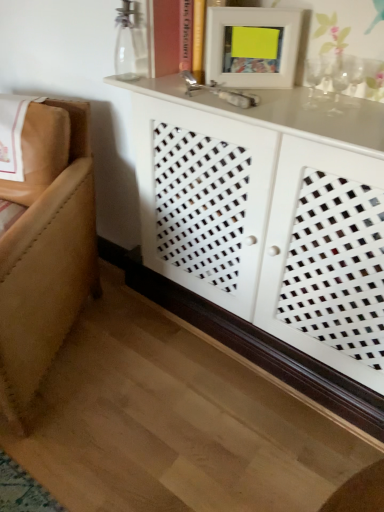
Question: Is white lattice cabinet at center smaller than clear glass vase at upper center?

Choices:
 (A) yes
 (B) no

Answer: (B)

Question: Is white lattice cabinet at center not inside clear glass vase at upper center?

Choices:
 (A) no
 (B) yes

Answer: (B)

Question: Is white lattice cabinet at center at the left side of clear glass vase at upper center?

Choices:
 (A) yes
 (B) no

Answer: (B)

Question: Does white lattice cabinet at center lie in front of clear glass vase at upper center?

Choices:
 (A) no
 (B) yes

Answer: (B)

Question: Is white lattice cabinet at center further to camera compared to clear glass vase at upper center?

Choices:
 (A) no
 (B) yes

Answer: (A)

Question: Visually, is tan leather couch at left positioned to the left or to the right of white lattice cabinet at center?

Choices:
 (A) right
 (B) left

Answer: (B)

Question: Relative to white lattice cabinet at center, is tan leather couch at left in front or behind?

Choices:
 (A) behind
 (B) front

Answer: (A)

Question: In terms of size, does tan leather couch at left appear bigger or smaller than white lattice cabinet at center?

Choices:
 (A) big
 (B) small

Answer: (B)

Question: From a real-world perspective, is tan leather couch at left positioned above or below white lattice cabinet at center?

Choices:
 (A) above
 (B) below

Answer: (B)

Question: Considering the positions of white matte picture frame at upper center and white lattice cabinet at center in the image, is white matte picture frame at upper center wider or thinner than white lattice cabinet at center?

Choices:
 (A) thin
 (B) wide

Answer: (A)

Question: Is white matte picture frame at upper center to the left or to the right of white lattice cabinet at center in the image?

Choices:
 (A) right
 (B) left

Answer: (B)

Question: Is white matte picture frame at upper center spatially inside white lattice cabinet at center, or outside of it?

Choices:
 (A) outside
 (B) inside

Answer: (B)

Question: From the image's perspective, is white matte picture frame at upper center located above or below white lattice cabinet at center?

Choices:
 (A) below
 (B) above

Answer: (B)

Question: From the image's perspective, is tan leather couch at left positioned above or below white matte picture frame at upper center?

Choices:
 (A) below
 (B) above

Answer: (A)

Question: From a real-world perspective, is tan leather couch at left above or below white matte picture frame at upper center?

Choices:
 (A) below
 (B) above

Answer: (A)